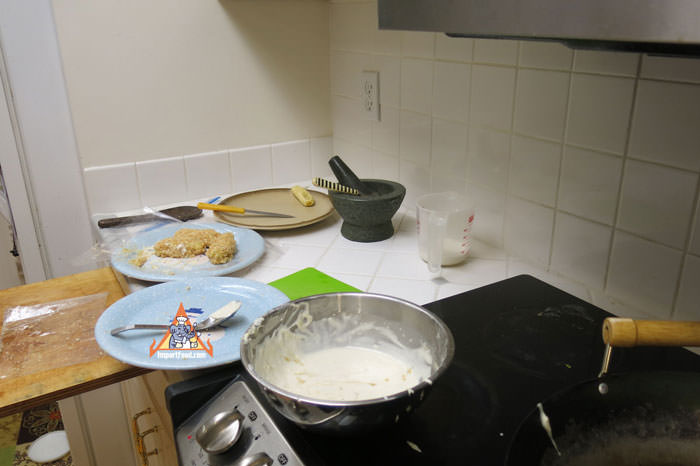
The width and height of the screenshot is (700, 466). Identify the location of counter. (386, 269).